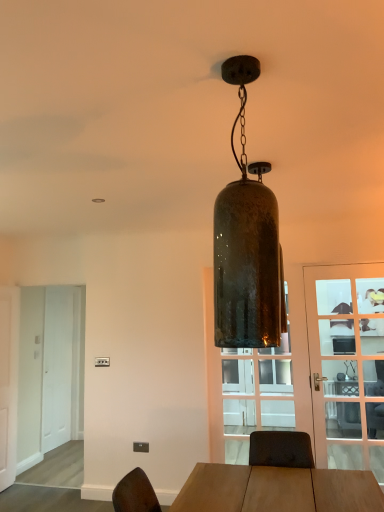
Consider the image. What is the approximate width of white matte door at left, positioned as the second screen door in back-to-front order?

It is 9.49 inches.

Locate an element on the screen. The height and width of the screenshot is (512, 384). white matte door at left, positioned as the second screen door in back-to-front order is located at coordinates (49, 371).

What is the approximate height of clear glass door at center right, which is the second door in left-to-right order?

clear glass door at center right, which is the second door in left-to-right order, is 1.96 meters in height.

Describe the element at coordinates (347, 365) in the screenshot. I see `clear glass door at center right, which is the 2th door in back-to-front order` at that location.

How much space does white matte door at left, marked as the second door in a front-to-back arrangement, occupy vertically?

The height of white matte door at left, marked as the second door in a front-to-back arrangement, is 6.54 feet.

Measure the distance between white matte door at left, the 1th door from the left, and camera.

A distance of 4.02 meters exists between white matte door at left, the 1th door from the left, and camera.

The height and width of the screenshot is (512, 384). Identify the location of green glass pendant light at center. (247, 243).

Locate an element on the screen. This screenshot has width=384, height=512. white matte door at left, marked as the first screen door in a front-to-back arrangement is located at coordinates (49, 371).

Is white matte door at left, positioned as the second screen door in back-to-front order, smaller than white matte door at left, the 1th door from the left?

Incorrect, white matte door at left, positioned as the second screen door in back-to-front order, is not smaller in size than white matte door at left, the 1th door from the left.

Which is closer to the camera, (56,398) or (7,416)?

Point (7,416)

Between white matte door at left, positioned as the second screen door in back-to-front order, and white matte door at left, the 2th door viewed from the right, which one has more height?

white matte door at left, positioned as the second screen door in back-to-front order, is taller.

Would you say white matte door at left, positioned as the second screen door in back-to-front order, contains white matte door at left, which appears as the first door when viewed from the back?

No, white matte door at left, which appears as the first door when viewed from the back, is located outside of white matte door at left, positioned as the second screen door in back-to-front order.

Considering the relative sizes of clear glass door at center right, which is the second door in left-to-right order, and white matte door at left, which appears as the first door when viewed from the back, in the image provided, is clear glass door at center right, which is the second door in left-to-right order, bigger than white matte door at left, which appears as the first door when viewed from the back,?

No.

How far apart are clear glass door at center right, the first door positioned from the right, and white matte door at left, the 1th door from the left?

clear glass door at center right, the first door positioned from the right, is 3.20 meters away from white matte door at left, the 1th door from the left.

From the image's perspective, does clear glass door at center right, the first door positioned from the right, appear lower than white matte door at left, the 1th door from the left?

Actually, clear glass door at center right, the first door positioned from the right, appears above white matte door at left, the 1th door from the left, in the image.

The height and width of the screenshot is (512, 384). Identify the location of door behind the clear glass door at center right, which is the 2th door in back-to-front order. (8, 382).

Considering the relative sizes of white matte door at left, marked as the first screen door in a front-to-back arrangement, and clear glass door at center right, which is the second door in left-to-right order, in the image provided, is white matte door at left, marked as the first screen door in a front-to-back arrangement, thinner than clear glass door at center right, which is the second door in left-to-right order,?

In fact, white matte door at left, marked as the first screen door in a front-to-back arrangement, might be wider than clear glass door at center right, which is the second door in left-to-right order.

In the scene shown: Considering the relative sizes of white matte door at left, positioned as the second screen door in back-to-front order, and clear glass door at center right, which is the 2th door in back-to-front order, in the image provided, is white matte door at left, positioned as the second screen door in back-to-front order, smaller than clear glass door at center right, which is the 2th door in back-to-front order,?

No, white matte door at left, positioned as the second screen door in back-to-front order, is not smaller than clear glass door at center right, which is the 2th door in back-to-front order.

Which is behind, point (44, 304) or point (318, 411)?

The point (44, 304) is behind.

Can you tell me how much white matte door at left, marked as the first screen door in a front-to-back arrangement, and clear glass door at center right, which appears as the first door when viewed from the front, differ in facing direction?

The facing directions of white matte door at left, marked as the first screen door in a front-to-back arrangement, and clear glass door at center right, which appears as the first door when viewed from the front, are 4.06 degrees apart.

Is white matte door at left, the 1th door from the left, outside of clear glass door at center right, which appears as the first door when viewed from the front?

Absolutely, white matte door at left, the 1th door from the left, is external to clear glass door at center right, which appears as the first door when viewed from the front.

Does white matte door at left, the 1th door from the left, appear on the left side of clear glass door at center right, which is the second door in left-to-right order?

Correct, you'll find white matte door at left, the 1th door from the left, to the left of clear glass door at center right, which is the second door in left-to-right order.

Where is `door that is in front of the white matte door at left, marked as the second door in a front-to-back arrangement`? door that is in front of the white matte door at left, marked as the second door in a front-to-back arrangement is located at coordinates click(x=347, y=365).

Which is behind, point (375, 394) or point (238, 422)?

Positioned behind is point (238, 422).

From the image's perspective, is clear glass door at center right, which is the 2th door in back-to-front order, beneath transparent glass door at center?

Yes, from the image's perspective, clear glass door at center right, which is the 2th door in back-to-front order, is below transparent glass door at center.

Which is in front, clear glass door at center right, which is the 2th door in back-to-front order, or transparent glass door at center?

Positioned in front is clear glass door at center right, which is the 2th door in back-to-front order.

Considering the positions of objects clear glass door at center right, the first door positioned from the right, and transparent glass door at center in the image provided, who is more to the left, clear glass door at center right, the first door positioned from the right, or transparent glass door at center?

transparent glass door at center.

Is transparent glass door at center wider than green glass pendant light at center?

In fact, transparent glass door at center might be narrower than green glass pendant light at center.

Is transparent glass door at center inside or outside of green glass pendant light at center?

transparent glass door at center is located beyond the bounds of green glass pendant light at center.

Between transparent glass door at center and green glass pendant light at center, which one has more height?

Standing taller between the two is transparent glass door at center.

Considering the positions of point (283, 380) and point (277, 242), is point (283, 380) closer or farther from the camera than point (277, 242)?

Point (283, 380) appears to be farther away from the viewer than point (277, 242).

Is white wooden screen door at left, which is the second screen door in front-to-back order, behind clear glass door at center right, the first door positioned from the right?

Yes, white wooden screen door at left, which is the second screen door in front-to-back order, is behind clear glass door at center right, the first door positioned from the right.

Is white wooden screen door at left, which is the second screen door in front-to-back order, looking in the opposite direction of clear glass door at center right, which is the second door in left-to-right order?

That's not correct — white wooden screen door at left, which is the second screen door in front-to-back order, is not looking away from clear glass door at center right, which is the second door in left-to-right order.

Considering the sizes of objects white wooden screen door at left, the first screen door positioned from the back, and clear glass door at center right, which is the 2th door in back-to-front order, in the image provided, who is thinner, white wooden screen door at left, the first screen door positioned from the back, or clear glass door at center right, which is the 2th door in back-to-front order,?

clear glass door at center right, which is the 2th door in back-to-front order.

This screenshot has width=384, height=512. I want to click on door that is on the left side of white matte door at left, positioned as the second screen door in back-to-front order, so click(8, 382).

There is a white matte door at left, which appears as the first door when viewed from the back. Identify the location of door above it (from a real-world perspective). This screenshot has width=384, height=512. 347,365.

Looking at the image, which one is located further to white matte door at left, the 2th door viewed from the right, white wooden screen door at left, which is the second screen door in front-to-back order, or transparent glass door at center?

The object further to white matte door at left, the 2th door viewed from the right, is transparent glass door at center.

Looking at the image, which one is located further to white matte door at left, positioned as the second screen door in back-to-front order, green glass pendant light at center or white matte door at left, marked as the second door in a front-to-back arrangement?

Based on the image, green glass pendant light at center appears to be further to white matte door at left, positioned as the second screen door in back-to-front order.

Which object lies nearer to the anchor point white matte door at left, which appears as the first door when viewed from the back, transparent glass door at center or green glass pendant light at center?

The object closer to white matte door at left, which appears as the first door when viewed from the back, is transparent glass door at center.

Considering their positions, is white matte door at left, the 2th door viewed from the right, positioned further to clear glass door at center right, the first door positioned from the right, than green glass pendant light at center?

white matte door at left, the 2th door viewed from the right.

Which object lies further to the anchor point clear glass door at center right, which is the second door in left-to-right order, white matte door at left, which appears as the first door when viewed from the back, or transparent glass door at center?

Based on the image, white matte door at left, which appears as the first door when viewed from the back, appears to be further to clear glass door at center right, which is the second door in left-to-right order.

Based on their spatial positions, is green glass pendant light at center or white matte door at left, positioned as the second screen door in back-to-front order, closer to white wooden screen door at left, the first screen door positioned from the back?

The object closer to white wooden screen door at left, the first screen door positioned from the back, is white matte door at left, positioned as the second screen door in back-to-front order.

Considering their positions, is transparent glass door at center positioned closer to white wooden screen door at left, the first screen door positioned from the back, than green glass pendant light at center?

The object closer to white wooden screen door at left, the first screen door positioned from the back, is transparent glass door at center.

Looking at the image, which one is located closer to white wooden screen door at left, which is the second screen door in front-to-back order, white matte door at left, marked as the second door in a front-to-back arrangement, or green glass pendant light at center?

white matte door at left, marked as the second door in a front-to-back arrangement, lies closer to white wooden screen door at left, which is the second screen door in front-to-back order, than the other object.

Find the location of a particular element. This screenshot has height=512, width=384. glass door between white wooden screen door at left, which is the second screen door in front-to-back order, and clear glass door at center right, which is the 2th door in back-to-front order, from left to right is located at coordinates (256, 394).

The image size is (384, 512). I want to click on glass door between white matte door at left, positioned as the second screen door in back-to-front order, and clear glass door at center right, the first door positioned from the right, in the horizontal direction, so click(x=256, y=394).

Locate an element on the screen. This screenshot has width=384, height=512. screen door located between white wooden screen door at left, which is the second screen door in front-to-back order, and transparent glass door at center in the left-right direction is located at coordinates (49, 371).

Identify the location of screen door situated between white wooden screen door at left, which is the second screen door in front-to-back order, and clear glass door at center right, the first door positioned from the right, from left to right. The image size is (384, 512). (49, 371).